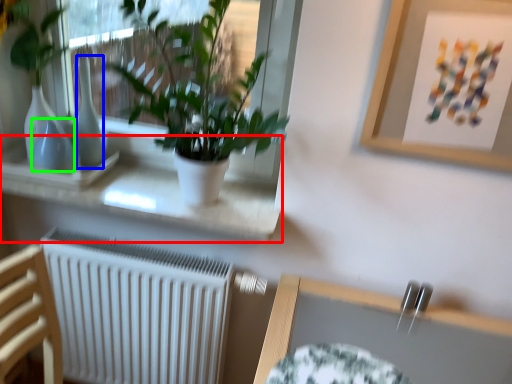
Question: Which object is positioned closest to window sill (highlighted by a red box)? Select from vase (highlighted by a blue box) and vase (highlighted by a green box).

Choices:
 (A) vase
 (B) vase

Answer: (A)